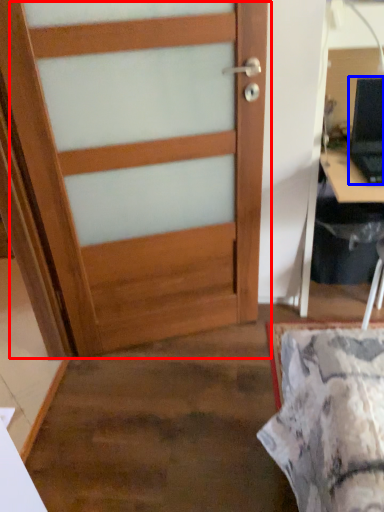
Question: Which point is further to the camera, door (highlighted by a red box) or laptop (highlighted by a blue box)?

Choices:
 (A) door
 (B) laptop

Answer: (B)